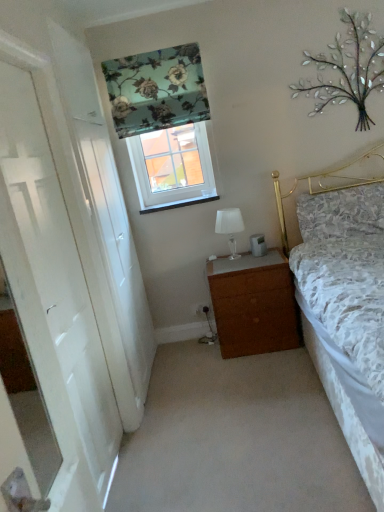
What are the coordinates of `vacant area that is situated to the right of white glossy door at left` in the screenshot? It's located at (175, 456).